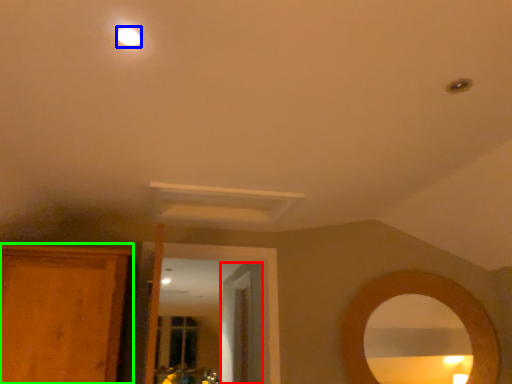
Question: Which object is positioned farthest from door (highlighted by a red box)? Select from lighting (highlighted by a blue box) and cabinetry (highlighted by a green box).

Choices:
 (A) lighting
 (B) cabinetry

Answer: (A)